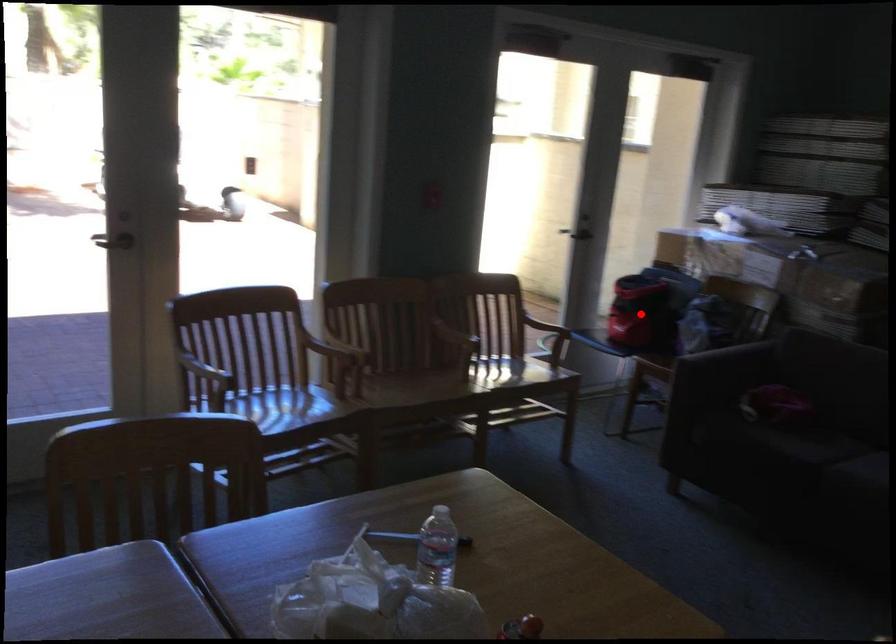
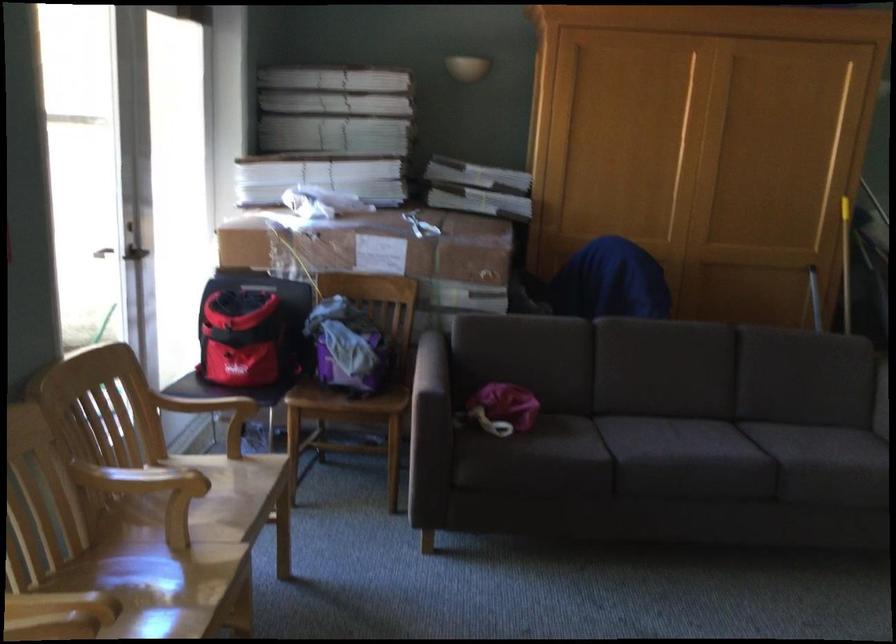
The point at the highlighted location is marked in the first image. Where is the corresponding point in the second image?

(271, 360)